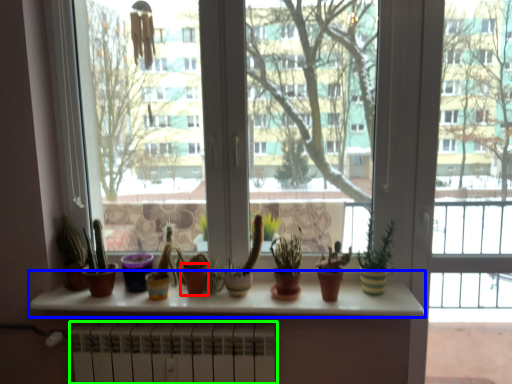
Question: Estimate the real-world distances between objects in this image. Which object is closer to flowerpot (highlighted by a red box), window sill (highlighted by a blue box) or radiator (highlighted by a green box)?

Choices:
 (A) window sill
 (B) radiator

Answer: (B)